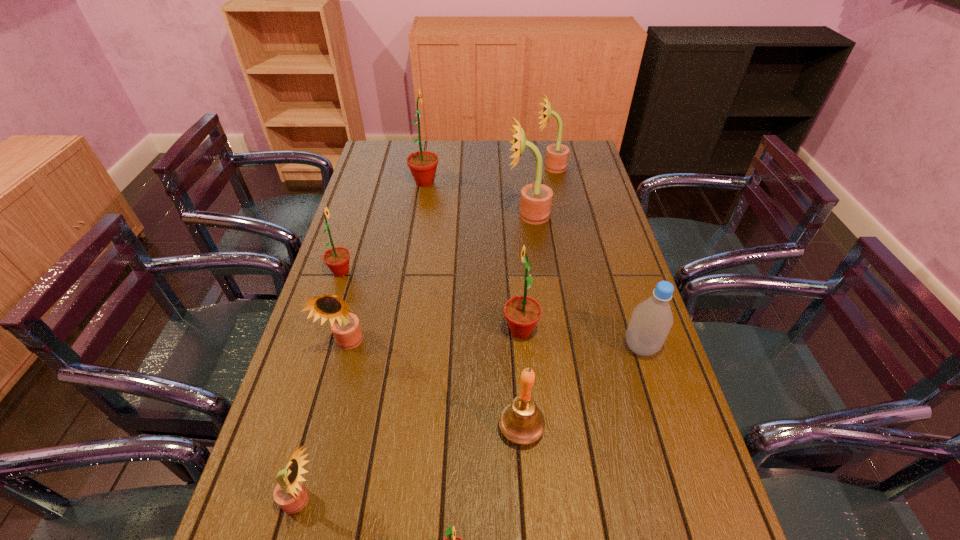
The height and width of the screenshot is (540, 960). In order to click on object at the far edge in this screenshot , I will do `click(557, 154)`.

This screenshot has width=960, height=540. I want to click on sunflower that is at the right edge, so click(557, 154).

What are the coordinates of `bottle that is at the right edge` in the screenshot? It's located at (650, 323).

Image resolution: width=960 pixels, height=540 pixels. In order to click on object positioned at the far right corner in this screenshot , I will do [557, 154].

I want to click on vacant region at the far edge of the desktop, so click(455, 160).

Locate an element on the screen. The image size is (960, 540). free space at the left edge of the desktop is located at coordinates (386, 184).

What are the coordinates of `free location at the right edge of the desktop` in the screenshot? It's located at (666, 376).

Identify the location of vacant space at the far left corner of the desktop. The image size is (960, 540). (383, 146).

In the image, there is a desktop. Where is `vacant area at the far right corner`? The width and height of the screenshot is (960, 540). vacant area at the far right corner is located at coordinates (582, 162).

Image resolution: width=960 pixels, height=540 pixels. In order to click on free space between the second farthest green sunflower and the second nearest object in this screenshot , I will do `click(321, 386)`.